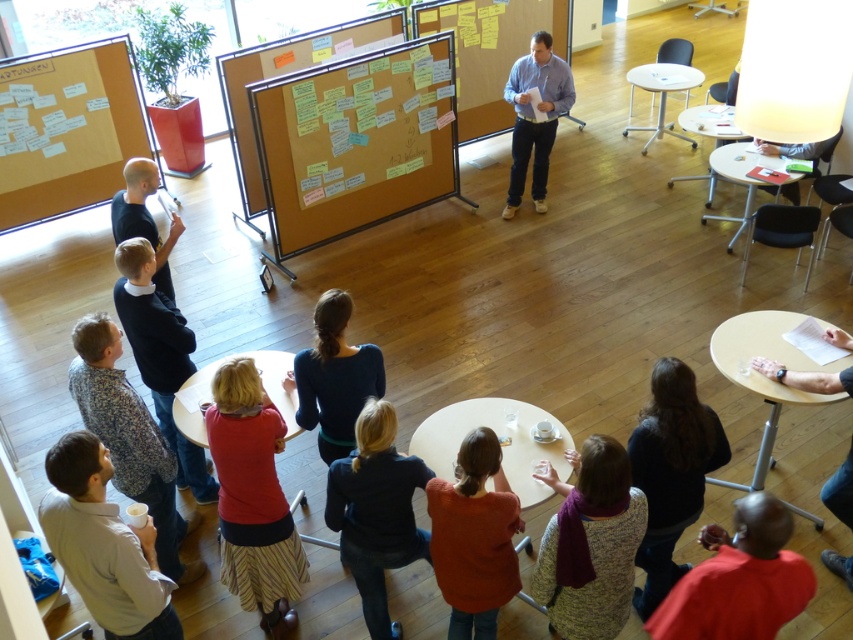
Question: Among these points, which one is farthest from the camera?

Choices:
 (A) (700, 564)
 (B) (577, 616)
 (C) (525, 442)

Answer: (C)

Question: Which of the following is the closest to the observer?

Choices:
 (A) orange sweater at lower center
 (B) red knit sweater at lower center

Answer: (A)

Question: Can you confirm if knitted sweater at lower center is positioned to the left of matte black table at lower right?

Choices:
 (A) no
 (B) yes

Answer: (B)

Question: In this image, where is red knit sweater at lower center located relative to matte black table at lower right?

Choices:
 (A) left
 (B) right

Answer: (A)

Question: Can you confirm if blue shirt at center is bigger than wooden round table at lower center?

Choices:
 (A) yes
 (B) no

Answer: (A)

Question: Which object appears farthest from the camera in this image?

Choices:
 (A) red knit sweater at lower center
 (B) white paperboard at upper left
 (C) dark blue sweater at center
 (D) white plastic table at upper right

Answer: (D)